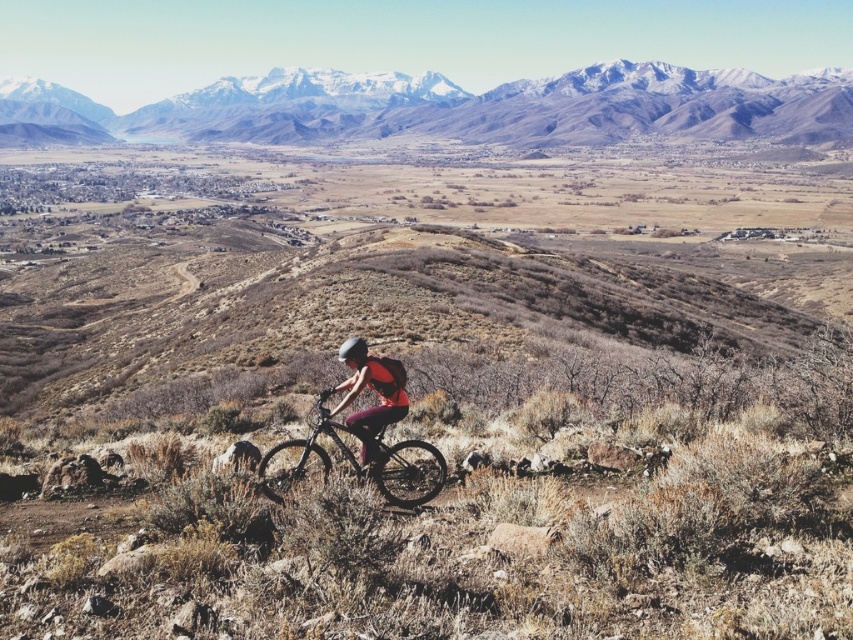
Image resolution: width=853 pixels, height=640 pixels. What do you see at coordinates (473, 106) in the screenshot?
I see `snowy rocky mountain at upper center` at bounding box center [473, 106].

Which is in front, point (582, 68) or point (364, 358)?

Positioned in front is point (364, 358).

The height and width of the screenshot is (640, 853). Describe the element at coordinates (473, 106) in the screenshot. I see `snowy rocky mountain at upper center` at that location.

In order to click on snowy rocky mountain at upper center in this screenshot , I will do `click(473, 106)`.

Between shiny black frame at center and matte pink shorts at center, which one is positioned lower?

shiny black frame at center

Is shiny black frame at center closer to the viewer compared to matte pink shorts at center?

That is True.

What do you see at coordinates (358, 461) in the screenshot? This screenshot has width=853, height=640. I see `shiny black frame at center` at bounding box center [358, 461].

Identify the location of shiny black frame at center. (358, 461).

Is snowy rocky mountain at upper center thinner than shiny black frame at center?

In fact, snowy rocky mountain at upper center might be wider than shiny black frame at center.

Does point (737, 77) lie behind point (268, 470)?

Yes, it is behind point (268, 470).

Identify the location of snowy rocky mountain at upper center. The height and width of the screenshot is (640, 853). (473, 106).